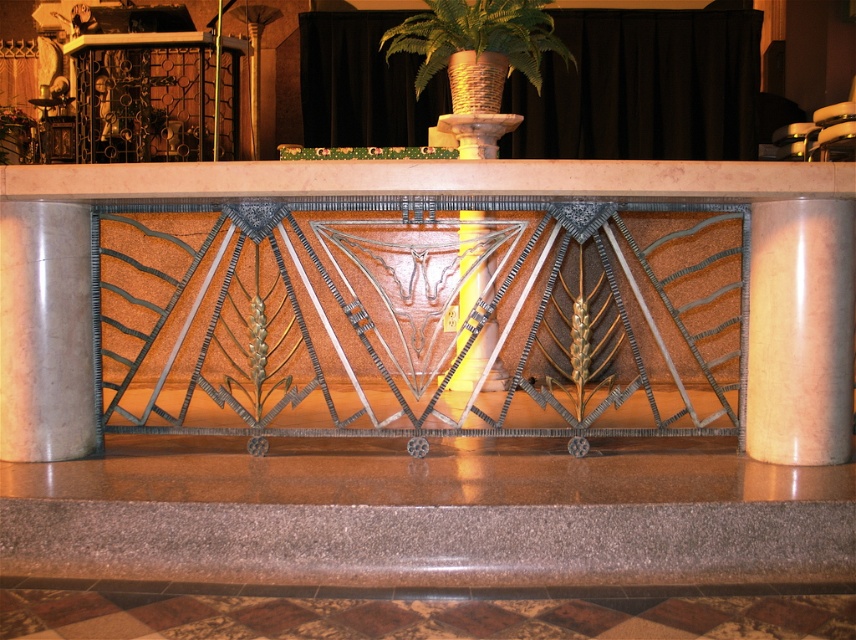
Identify the location of smooth marble pillar at left. This screenshot has width=856, height=640. (45, 332).

Can you confirm if smooth marble pillar at left is positioned below green woven basket at center?

Correct, smooth marble pillar at left is located below green woven basket at center.

Describe the element at coordinates (45, 332) in the screenshot. I see `smooth marble pillar at left` at that location.

Locate an element on the screen. The height and width of the screenshot is (640, 856). smooth marble pillar at left is located at coordinates (45, 332).

Which is in front, point (776, 376) or point (482, 108)?

Positioned in front is point (776, 376).

Which is in front, point (810, 374) or point (533, 58)?

Point (810, 374) is more forward.

Where is `matte pink marble pillar at right`? This screenshot has width=856, height=640. matte pink marble pillar at right is located at coordinates (800, 332).

Is point (52, 433) positioned before point (488, 141)?

Yes, point (52, 433) is in front of point (488, 141).

Does smooth marble pillar at left have a greater width compared to metallic polished pillar at center?

Indeed, smooth marble pillar at left has a greater width compared to metallic polished pillar at center.

What do you see at coordinates (45, 332) in the screenshot?
I see `smooth marble pillar at left` at bounding box center [45, 332].

The width and height of the screenshot is (856, 640). In order to click on smooth marble pillar at left in this screenshot , I will do `click(45, 332)`.